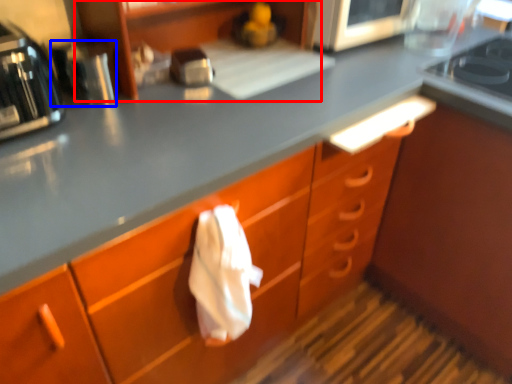
Question: Which of the following is the closest to the observer, shelf (highlighted by a red box) or appliance (highlighted by a blue box)?

Choices:
 (A) shelf
 (B) appliance

Answer: (A)